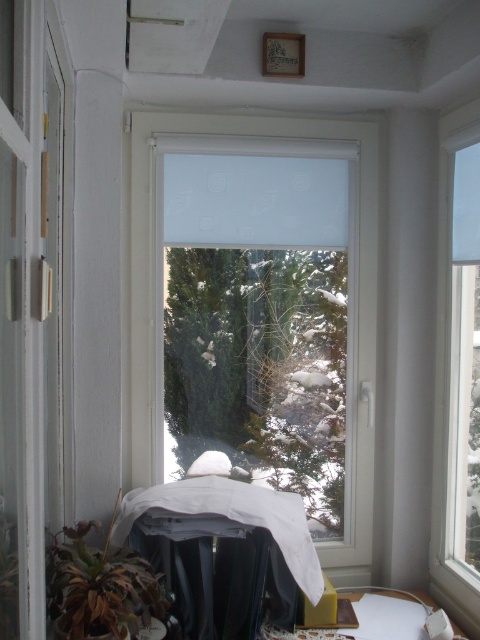
Question: Among these objects, which one is nearest to the camera?

Choices:
 (A) transparent glass window at right
 (B) green matte plant at lower left

Answer: (B)

Question: Does transparent plastic window at center come behind green matte plant at lower left?

Choices:
 (A) yes
 (B) no

Answer: (A)

Question: Among these objects, which one is farthest from the camera?

Choices:
 (A) transparent plastic window at center
 (B) green matte plant at lower left

Answer: (A)

Question: Is transparent plastic window at center thinner than green matte plant at lower left?

Choices:
 (A) yes
 (B) no

Answer: (B)

Question: Which object is farther from the camera taking this photo?

Choices:
 (A) green matte plant at lower left
 (B) transparent glass window at right

Answer: (B)

Question: Is the position of transparent glass window at right more distant than that of green matte plant at lower left?

Choices:
 (A) no
 (B) yes

Answer: (B)